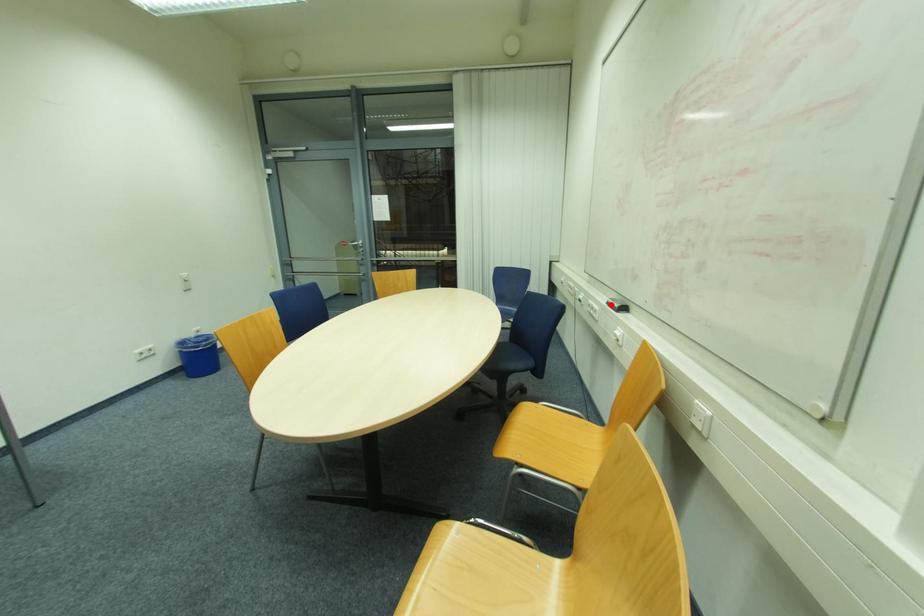
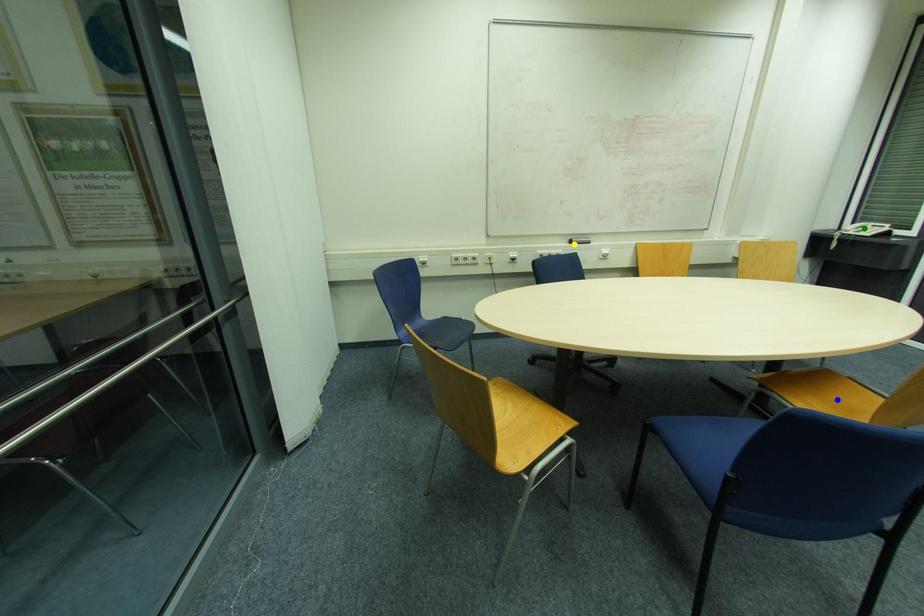
Question: I am providing you with two images of the same scene from different viewpoints. A red point is marked on the first image. You are given multiple points on the second image. In image 2, which mark is for the same physical point as the one in image 1?

Choices:
 (A) green point
 (B) yellow point
 (C) blue point

Answer: (B)